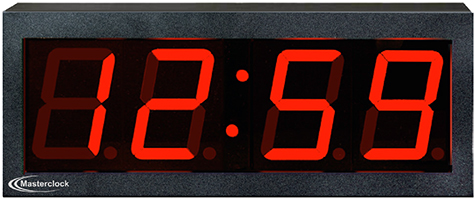
Image resolution: width=476 pixels, height=200 pixels. What are the coordinates of `charcoal trim around clock` in the screenshot? It's located at (150, 186), (12, 95), (180, 18), (463, 106).